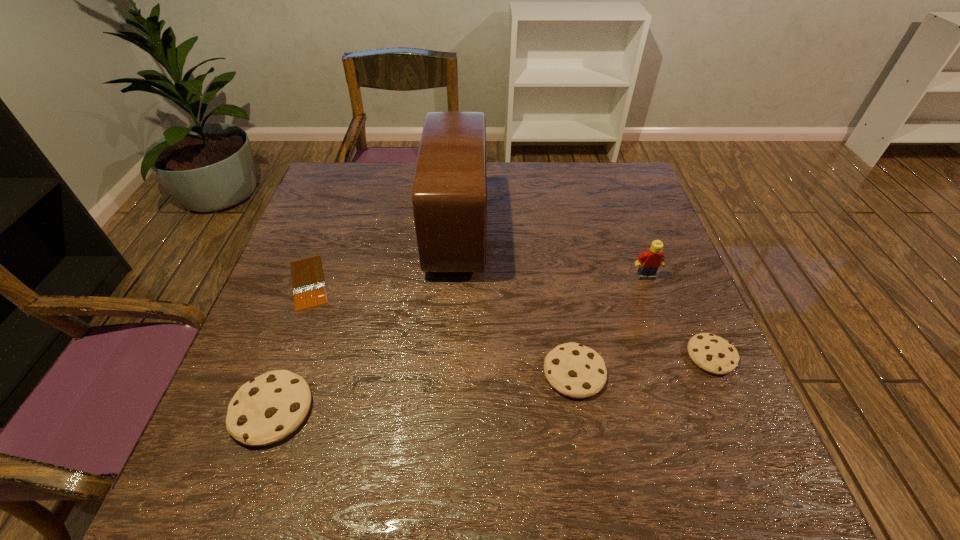
This screenshot has height=540, width=960. I want to click on empty space between the Lego and the third object from left to right, so click(x=551, y=253).

At what (x,y) coordinates should I click in order to perform the action: click on free space between the fifth tallest object and the radio receiver. Please return your answer as a coordinate pair (x, y). Looking at the image, I should click on (584, 293).

Identify the location of free space between the leftmost cookie and the rightmost cookie. The image size is (960, 540). (492, 383).

Identify the location of unoccupied area between the chocolate bar and the Lego. The image size is (960, 540). (477, 279).

The height and width of the screenshot is (540, 960). Find the location of `unoccupied area between the fourth object from right to left and the third tallest object`. unoccupied area between the fourth object from right to left and the third tallest object is located at coordinates (365, 320).

Identify the location of vacant region between the leftmost cookie and the shortest cookie. (492, 383).

Identify which object is located as the fifth nearest to the shortest object. Please provide its 2D coordinates. Your answer should be formatted as a tuple, i.e. [(x, y)], where the tuple contains the x and y coordinates of a point satisfying the conditions above.

[(713, 354)]

Where is `object identified as the closest to the chocolate bar`? This screenshot has width=960, height=540. object identified as the closest to the chocolate bar is located at coordinates (268, 408).

I want to click on the closest cookie relative to the third shortest object, so click(x=713, y=354).

Locate which cookie ranks in proximity to the shortest object. Please provide its 2D coordinates. Your answer should be formatted as a tuple, i.e. [(x, y)], where the tuple contains the x and y coordinates of a point satisfying the conditions above.

[(268, 408)]